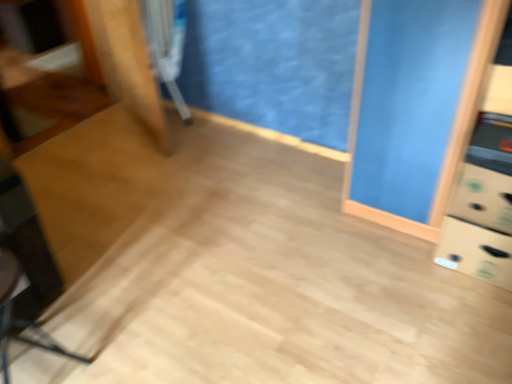
Locate an element on the screen. This screenshot has height=384, width=512. free space behind black plastic swivel chair at lower left, which appears as the 2th swivel chair when viewed from the back is located at coordinates pos(76,314).